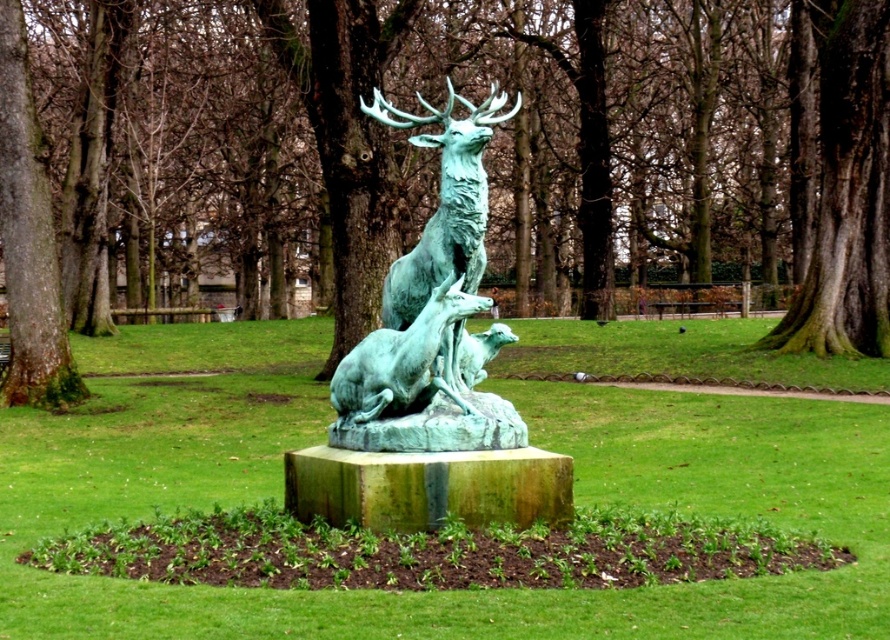
Which is below, dark brown textured bark at center right or green patinated bronze deer at center?

Positioned lower is dark brown textured bark at center right.

Is point (856, 113) closer to camera compared to point (400, 378)?

No, it is behind (400, 378).

Where is `dark brown textured bark at center right`? Image resolution: width=890 pixels, height=640 pixels. dark brown textured bark at center right is located at coordinates (847, 189).

Is green patina bronze deer at center shorter than dark brown textured bark at center right?

No, green patina bronze deer at center is not shorter than dark brown textured bark at center right.

Is point (433, 273) closer to camera compared to point (868, 132)?

Yes, point (433, 273) is in front of point (868, 132).

Does point (450, 339) lie in front of point (851, 184)?

Yes, it is in front of point (851, 184).

You are a GUI agent. You are given a task and a screenshot of the screen. Output one action in this format:
    pyautogui.click(x=<x>, y=<y>)
    Task: Click on the green patina bronze deer at center
    This screenshot has width=890, height=640.
    Given the screenshot: What is the action you would take?
    pyautogui.click(x=433, y=312)

Which is below, green mossy tree at center or dark brown textured bark at center right?

Positioned lower is dark brown textured bark at center right.

Is green mossy tree at center in front of dark brown textured bark at center right?

Yes, it is.

The image size is (890, 640). I want to click on green mossy tree at center, so click(442, 161).